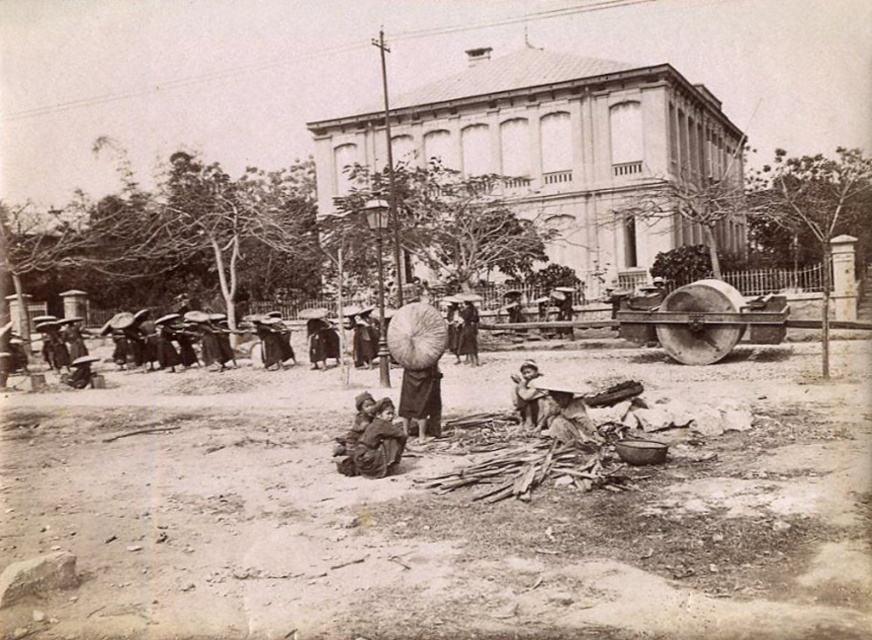
Question: Which of these objects is positioned closest to the dirt field at lower center?

Choices:
 (A) brown fabric children at center
 (B) brown woven basket at lower center

Answer: (A)

Question: Based on their relative distances, which object is nearer to the brown fabric child at center?

Choices:
 (A) brown woven basket at lower center
 (B) brown fabric children at center
 (C) dirt field at lower center

Answer: (A)

Question: Does brown fabric children at center have a smaller size compared to brown fabric child at center?

Choices:
 (A) yes
 (B) no

Answer: (A)

Question: From the image, what is the correct spatial relationship of dirt field at lower center in relation to brown fabric children at center?

Choices:
 (A) above
 (B) below

Answer: (A)

Question: Does brown fabric children at center appear on the right side of brown woven basket at lower center?

Choices:
 (A) no
 (B) yes

Answer: (A)

Question: Estimate the real-world distances between objects in this image. Which object is farther from the brown woven basket at lower center?

Choices:
 (A) brown fabric child at center
 (B) brown fabric children at center
 (C) dirt field at lower center

Answer: (C)